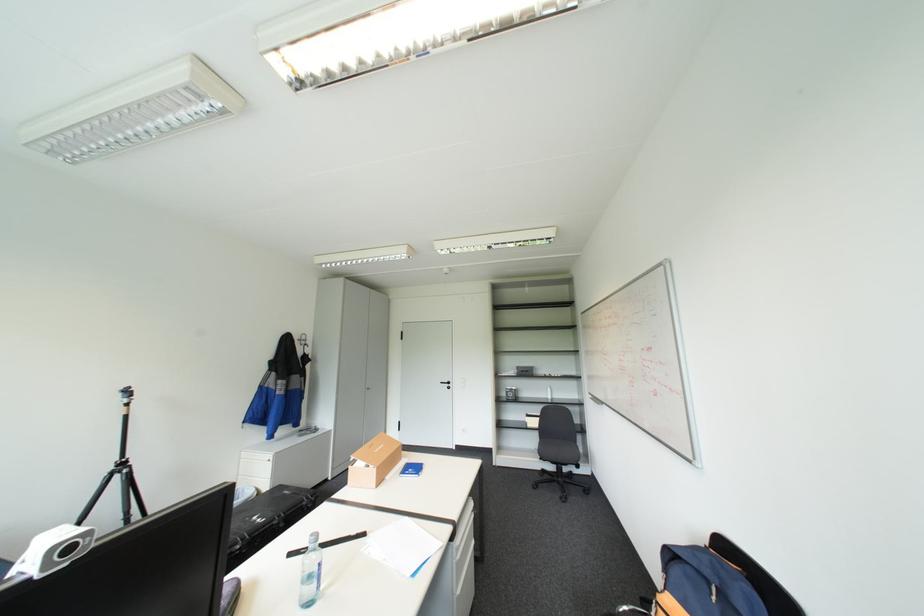
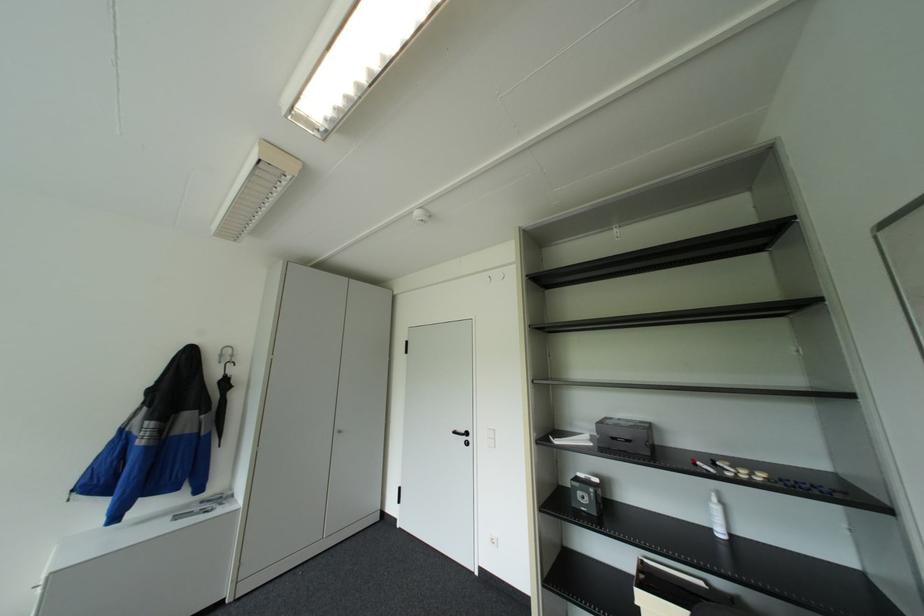
Where in the second image is the point corresponding to the point at 523,373 from the first image?

(600, 443)